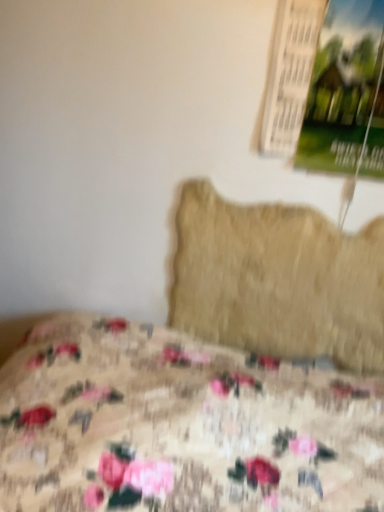
This screenshot has height=512, width=384. Find the location of `vacant area on top of beige fuzzy pillow at center (from a real-world perspective)`. vacant area on top of beige fuzzy pillow at center (from a real-world perspective) is located at coordinates (x=296, y=195).